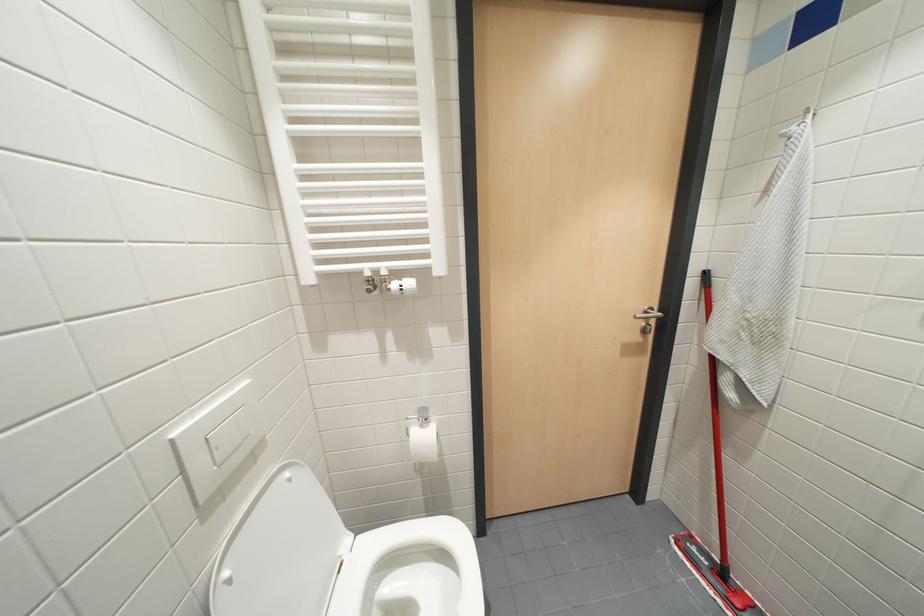
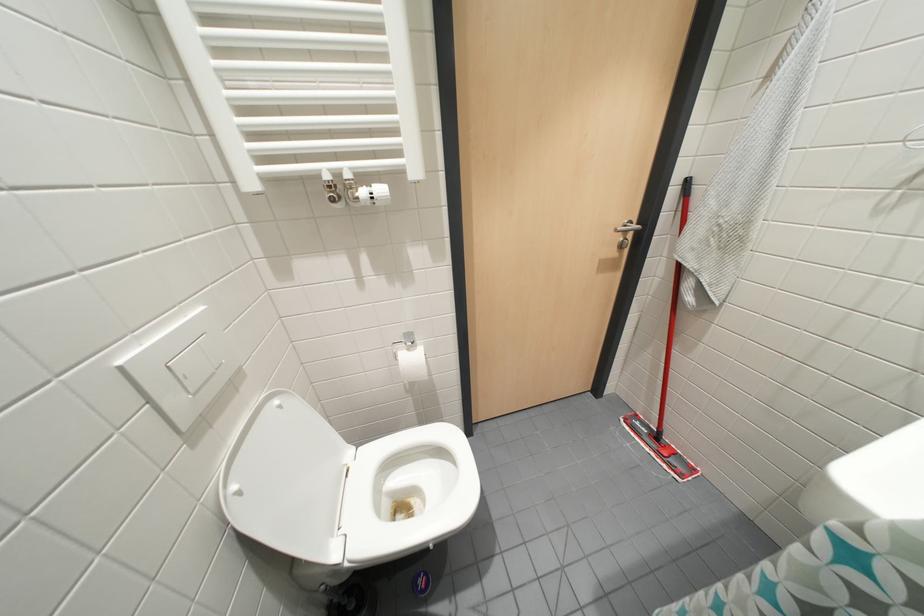
What movement of the cameraman would produce the second image?

The movement direction of the cameraman is left, forward.